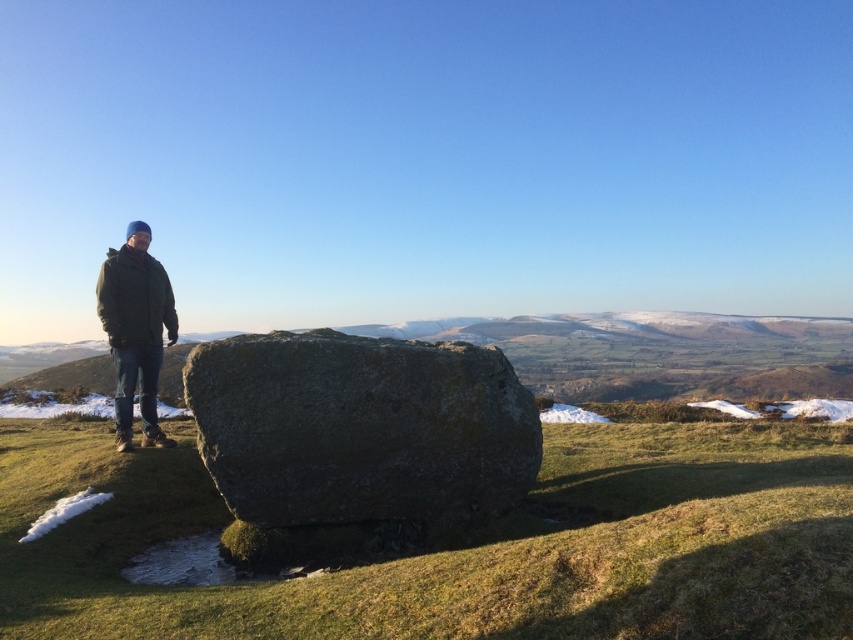
Does green mossy rock at center have a larger size compared to green woolen jacket at left?

Yes.

Is green mossy rock at center to the left of green woolen jacket at left from the viewer's perspective?

No, green mossy rock at center is not to the left of green woolen jacket at left.

Is point (97, 636) more distant than point (148, 416)?

No, it is not.

Where is `green mossy rock at center`? The image size is (853, 640). green mossy rock at center is located at coordinates (465, 544).

Is green mossy rock at center above gray rough stone at center?

No.

Is green mossy rock at center thinner than gray rough stone at center?

In fact, green mossy rock at center might be wider than gray rough stone at center.

Is point (842, 580) farther from camera compared to point (508, 458)?

No, it is not.

I want to click on green mossy rock at center, so click(465, 544).

Between gray rough stone at center and green woolen jacket at left, which one has more height?

Standing taller between the two is green woolen jacket at left.

Does gray rough stone at center have a lesser height compared to green woolen jacket at left?

Yes, gray rough stone at center is shorter than green woolen jacket at left.

Who is more distant from viewer, (456,413) or (109,248)?

The point (109,248) is behind.

This screenshot has width=853, height=640. What are the coordinates of `gray rough stone at center` in the screenshot? It's located at (358, 426).